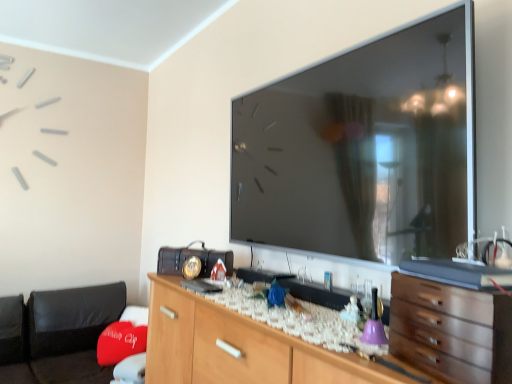
Question: Could you tell me if wooden cabinet at center is facing metallic vintage radio at center?

Choices:
 (A) yes
 (B) no

Answer: (B)

Question: Considering the relative positions of wooden cabinet at center and metallic vintage radio at center in the image provided, is wooden cabinet at center to the left of metallic vintage radio at center from the viewer's perspective?

Choices:
 (A) no
 (B) yes

Answer: (A)

Question: Considering the relative sizes of wooden cabinet at center and metallic vintage radio at center in the image provided, is wooden cabinet at center thinner than metallic vintage radio at center?

Choices:
 (A) no
 (B) yes

Answer: (A)

Question: From a real-world perspective, is wooden cabinet at center physically below metallic vintage radio at center?

Choices:
 (A) yes
 (B) no

Answer: (A)

Question: Can you confirm if wooden cabinet at center is taller than metallic vintage radio at center?

Choices:
 (A) yes
 (B) no

Answer: (A)

Question: Is wooden cabinet at center bigger than metallic vintage radio at center?

Choices:
 (A) yes
 (B) no

Answer: (A)

Question: Is wooden chest of drawers at lower right wider than red fabric bean bag at lower left?

Choices:
 (A) yes
 (B) no

Answer: (B)

Question: From the image's perspective, is wooden chest of drawers at lower right above red fabric bean bag at lower left?

Choices:
 (A) yes
 (B) no

Answer: (A)

Question: Is wooden chest of drawers at lower right closer to camera compared to red fabric bean bag at lower left?

Choices:
 (A) yes
 (B) no

Answer: (A)

Question: Is red fabric bean bag at lower left inside wooden chest of drawers at lower right?

Choices:
 (A) no
 (B) yes

Answer: (A)

Question: Does wooden chest of drawers at lower right have a lesser width compared to red fabric bean bag at lower left?

Choices:
 (A) no
 (B) yes

Answer: (B)

Question: Is wooden chest of drawers at lower right turned away from red fabric bean bag at lower left?

Choices:
 (A) yes
 (B) no

Answer: (B)

Question: From the image's perspective, would you say metallic vintage radio at center is positioned over wooden chest of drawers at lower right?

Choices:
 (A) no
 (B) yes

Answer: (A)